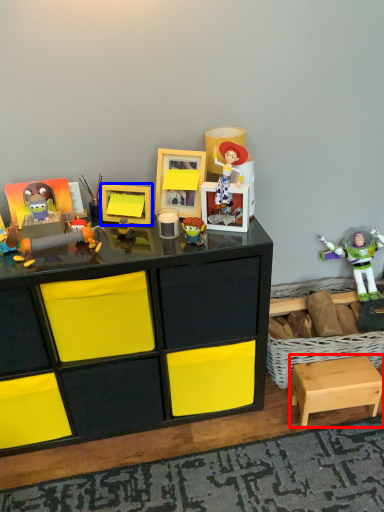
Question: Which object appears closest to the camera in this image, step stool (highlighted by a red box) or picture frame (highlighted by a blue box)?

Choices:
 (A) step stool
 (B) picture frame

Answer: (B)